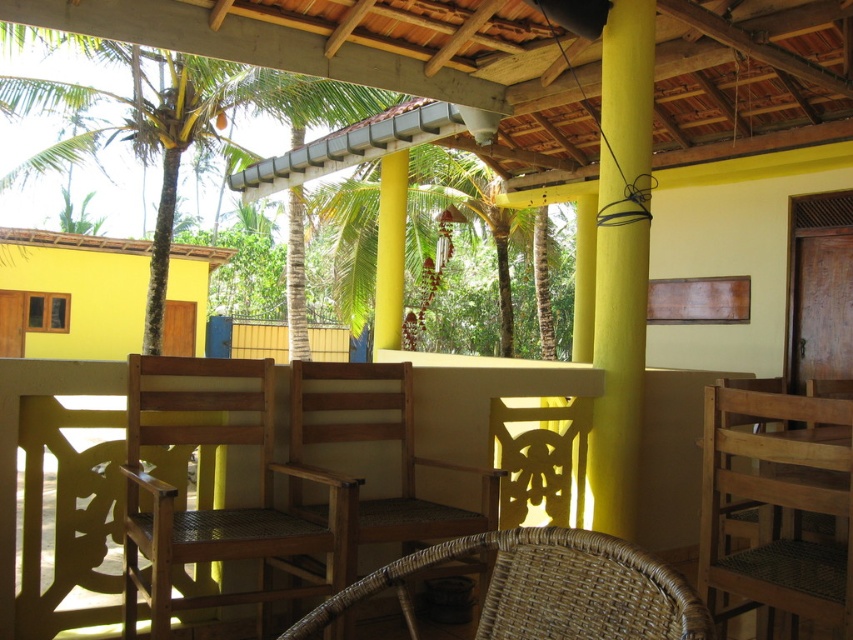
Question: Which of the following is the closest to the observer?

Choices:
 (A) natural wood chairs at center
 (B) woven wicker chair at center
 (C) wooden chair at center
 (D) wooden chair at right

Answer: (B)

Question: Which object is positioned farthest from the woven wicker chair at center?

Choices:
 (A) green leafy palm tree at upper left
 (B) brown woven chair at center
 (C) wooden chair at right
 (D) natural wood chairs at center

Answer: (A)

Question: Which point appears closest to the camera in this image?

Choices:
 (A) (244, 464)
 (B) (287, 97)
 (C) (850, 545)
 (D) (161, 496)

Answer: (C)

Question: Is natural wood chairs at center smaller than brown woven chair at center?

Choices:
 (A) no
 (B) yes

Answer: (B)

Question: Is woven wicker chair at center bigger than brown woven chair at center?

Choices:
 (A) no
 (B) yes

Answer: (A)

Question: Does wooden chair at center have a greater width compared to yellow matte/wooden pillar at center-right?

Choices:
 (A) yes
 (B) no

Answer: (A)